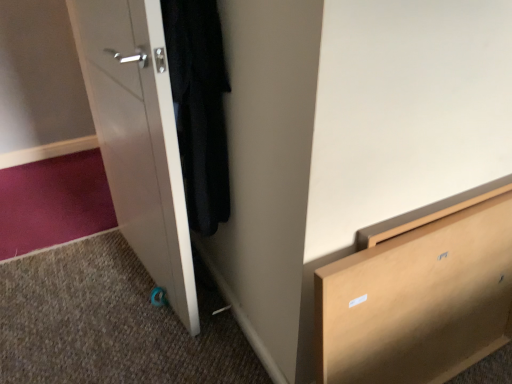
Question: Considering the relative sizes of light brown wooden chest of drawers at lower right and white glossy door at left in the image provided, is light brown wooden chest of drawers at lower right shorter than white glossy door at left?

Choices:
 (A) yes
 (B) no

Answer: (A)

Question: From the image's perspective, would you say light brown wooden chest of drawers at lower right is shown under white glossy door at left?

Choices:
 (A) yes
 (B) no

Answer: (A)

Question: Would you consider light brown wooden chest of drawers at lower right to be distant from white glossy door at left?

Choices:
 (A) no
 (B) yes

Answer: (A)

Question: Is light brown wooden chest of drawers at lower right in front of white glossy door at left?

Choices:
 (A) no
 (B) yes

Answer: (B)

Question: Is light brown wooden chest of drawers at lower right positioned with its back to white glossy door at left?

Choices:
 (A) no
 (B) yes

Answer: (B)

Question: Visually, is white glossy door at left positioned to the left or to the right of light brown wooden chest of drawers at lower right?

Choices:
 (A) right
 (B) left

Answer: (B)

Question: Considering their positions, is white glossy door at left located in front of or behind light brown wooden chest of drawers at lower right?

Choices:
 (A) front
 (B) behind

Answer: (B)

Question: Considering the positions of point (143, 183) and point (497, 276), is point (143, 183) closer or farther from the camera than point (497, 276)?

Choices:
 (A) farther
 (B) closer

Answer: (B)

Question: From the image's perspective, is white glossy door at left positioned above or below light brown wooden chest of drawers at lower right?

Choices:
 (A) below
 (B) above

Answer: (B)

Question: Relative to light brown wooden chest of drawers at lower right, is black matte coat at left in front or behind?

Choices:
 (A) front
 (B) behind

Answer: (B)

Question: Is black matte coat at left taller or shorter than light brown wooden chest of drawers at lower right?

Choices:
 (A) short
 (B) tall

Answer: (A)

Question: Considering the relative positions of black matte coat at left and light brown wooden chest of drawers at lower right in the image provided, is black matte coat at left to the left or to the right of light brown wooden chest of drawers at lower right?

Choices:
 (A) right
 (B) left

Answer: (B)

Question: Is black matte coat at left bigger or smaller than light brown wooden chest of drawers at lower right?

Choices:
 (A) big
 (B) small

Answer: (B)

Question: Looking at the image, does white glossy door at left seem bigger or smaller compared to black matte coat at left?

Choices:
 (A) big
 (B) small

Answer: (A)

Question: In terms of width, does white glossy door at left look wider or thinner when compared to black matte coat at left?

Choices:
 (A) wide
 (B) thin

Answer: (B)